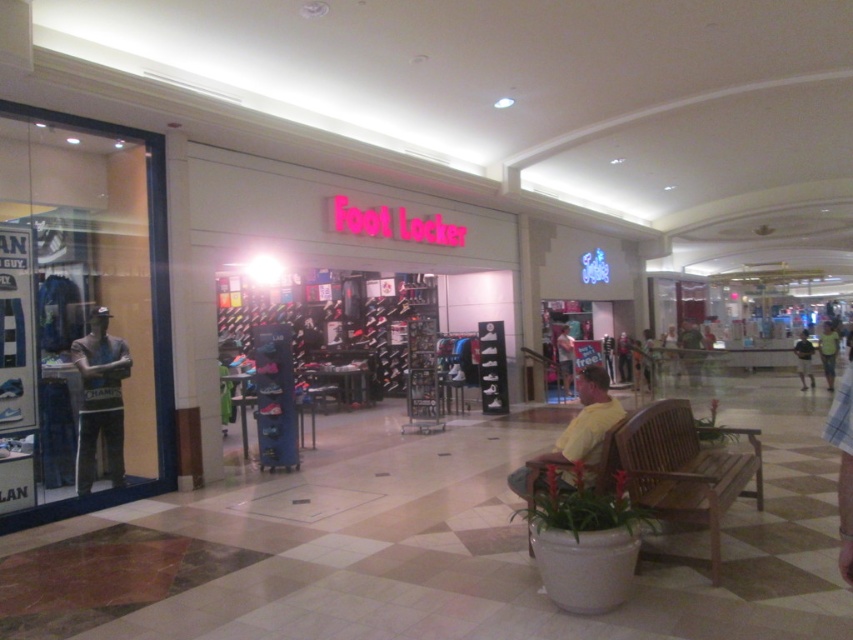
Based on the photo, you are standing at the entrance of the Foot Locker store in the mall. You see a point marked at coordinate (99, 400). Which object is this point located on?

The point is located on the gray fabric mannequin at left.

You are a customer in the Foot Locker store and you want to find an outfit to try on. You see the yellow cotton shirt at lower right and the light brown shorts at center. Which item is shorter in height?

The yellow cotton shirt at lower right is not as tall as the light brown shorts at center, so the yellow cotton shirt at lower right is shorter in height.

You are standing at the entrance of the Foot Locker store in the mall. You see two points marked on the floor. The first point is at coordinates point (521,490) and the second point is at point (802,360). Which point is closer to you?

Point (521,490) is closer to the viewer than point (802,360).